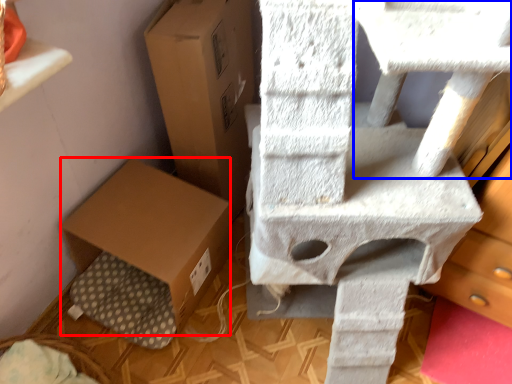
Question: Which object is closer to the camera taking this photo, cardboard box (highlighted by a red box) or table (highlighted by a blue box)?

Choices:
 (A) cardboard box
 (B) table

Answer: (B)